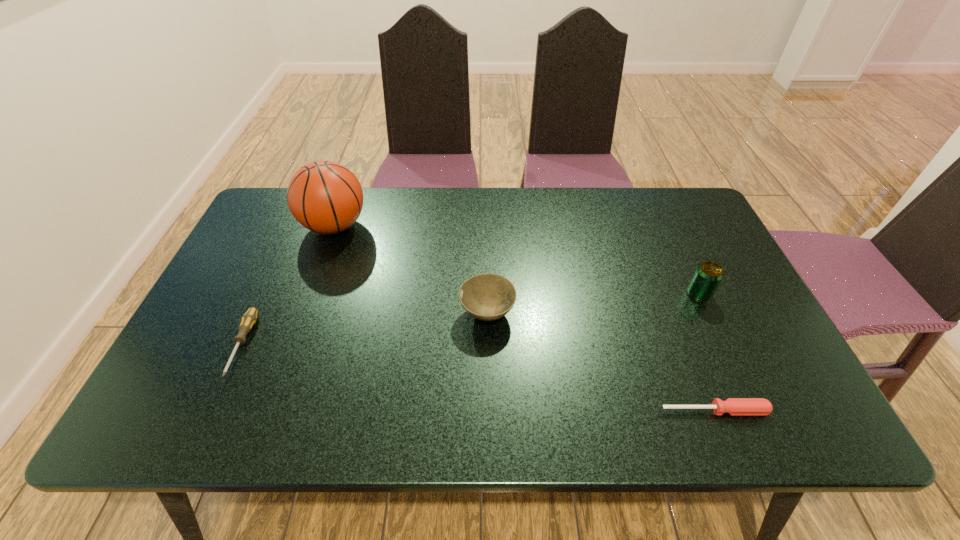
Where is `vacant point that satisfies the following two spatial constraints: 1. on the front side of the nearer screwdriver; 2. on the right side of the third object from right to left`? vacant point that satisfies the following two spatial constraints: 1. on the front side of the nearer screwdriver; 2. on the right side of the third object from right to left is located at coordinates (489, 410).